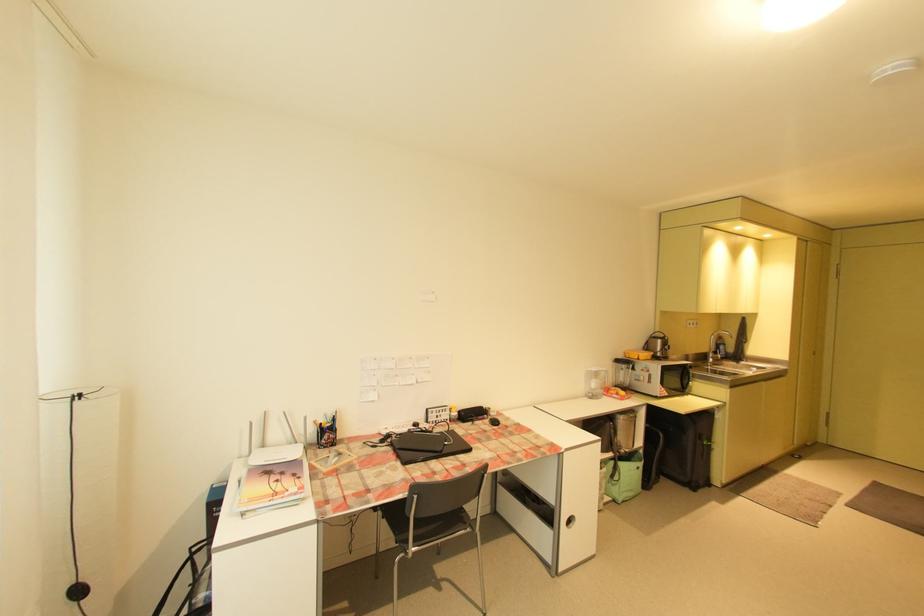
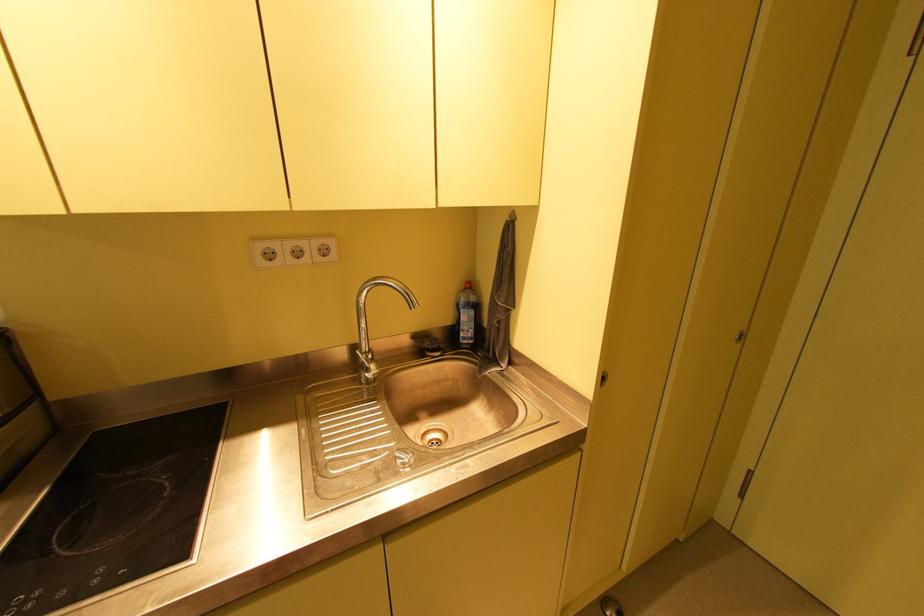
Which direction would the cameraman need to move to produce the second image?

The movement direction of the cameraman is right, forward.